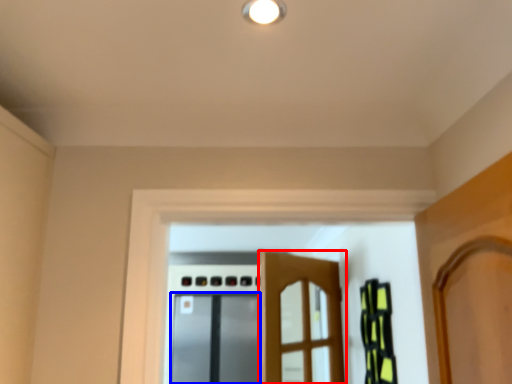
Question: Which of the following is the farthest to the observer, door (highlighted by a red box) or screen door (highlighted by a blue box)?

Choices:
 (A) door
 (B) screen door

Answer: (B)